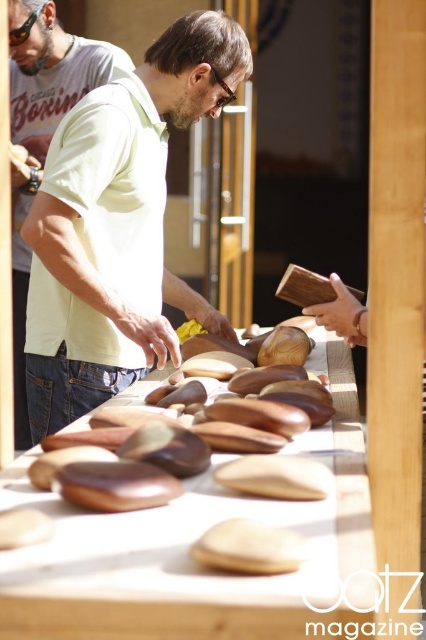
Question: Among these objects, which one is farthest from the camera?

Choices:
 (A) wooden table at center
 (B) matte green shirt at center

Answer: (B)

Question: Does wooden table at center appear under matte yellow shirt at center?

Choices:
 (A) yes
 (B) no

Answer: (A)

Question: Does matte green shirt at center appear on the left side of matte yellow shirt at center?

Choices:
 (A) no
 (B) yes

Answer: (A)

Question: Which point is farther to the camera?

Choices:
 (A) (34, 492)
 (B) (75, 228)

Answer: (B)

Question: Which object is positioned farthest from the matte green shirt at center?

Choices:
 (A) wooden table at center
 (B) matte yellow shirt at center

Answer: (B)

Question: Does matte green shirt at center have a lesser width compared to matte yellow shirt at center?

Choices:
 (A) no
 (B) yes

Answer: (A)